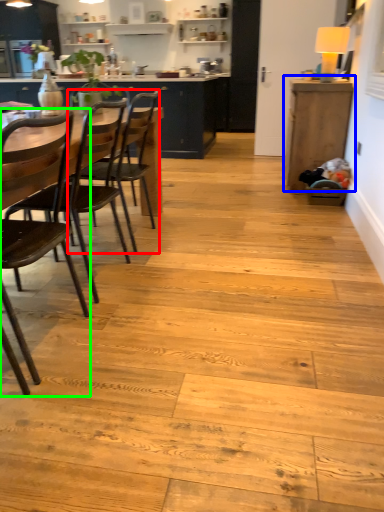
Question: Estimate the real-world distances between objects in this image. Which object is closer to chair (highlighted by a red box), cabinetry (highlighted by a blue box) or chair (highlighted by a green box)?

Choices:
 (A) cabinetry
 (B) chair

Answer: (B)